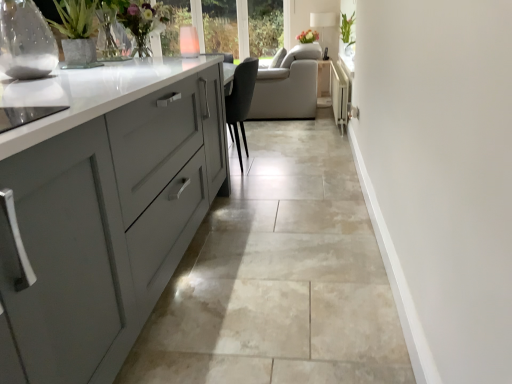
Question: Is green glossy plant at upper right far from clear glass vase at center, the 1th glass vase viewed from the back?

Choices:
 (A) no
 (B) yes

Answer: (A)

Question: Can you confirm if green glossy plant at upper right is wider than clear glass vase at center, which appears as the second glass vase when ordered from the bottom?

Choices:
 (A) yes
 (B) no

Answer: (A)

Question: Is the depth of green glossy plant at upper right less than that of clear glass vase at center, positioned as the second glass vase in left-to-right order?

Choices:
 (A) no
 (B) yes

Answer: (A)

Question: Considering the relative positions of green glossy plant at upper right and clear glass vase at center, the 1th glass vase viewed from the back, in the image provided, is green glossy plant at upper right to the right of clear glass vase at center, the 1th glass vase viewed from the back, from the viewer's perspective?

Choices:
 (A) no
 (B) yes

Answer: (B)

Question: Does green glossy plant at upper right have a greater height compared to clear glass vase at center, the 1th glass vase viewed from the back?

Choices:
 (A) yes
 (B) no

Answer: (A)

Question: Considering the relative positions of clear glass vase at upper left, positioned as the 1th glass vase in left-to-right order, and green glossy plant at upper right in the image provided, is clear glass vase at upper left, positioned as the 1th glass vase in left-to-right order, to the left or to the right of green glossy plant at upper right?

Choices:
 (A) right
 (B) left

Answer: (B)

Question: Considering the positions of clear glass vase at upper left, the 2th glass vase from the back, and green glossy plant at upper right in the image, is clear glass vase at upper left, the 2th glass vase from the back, wider or thinner than green glossy plant at upper right?

Choices:
 (A) wide
 (B) thin

Answer: (A)

Question: Considering their positions, is clear glass vase at upper left, positioned as the 1th glass vase in left-to-right order, located in front of or behind green glossy plant at upper right?

Choices:
 (A) front
 (B) behind

Answer: (A)

Question: In terms of size, does clear glass vase at upper left, the 2th glass vase from the back, appear bigger or smaller than green glossy plant at upper right?

Choices:
 (A) small
 (B) big

Answer: (A)

Question: Is beige tile floor at center wider or thinner than green glossy plant at upper right?

Choices:
 (A) thin
 (B) wide

Answer: (B)

Question: From the image's perspective, is beige tile floor at center located above or below green glossy plant at upper right?

Choices:
 (A) above
 (B) below

Answer: (B)

Question: Is point (331, 246) positioned closer to the camera than point (348, 29)?

Choices:
 (A) farther
 (B) closer

Answer: (B)

Question: Relative to green glossy plant at upper right, is beige tile floor at center in front or behind?

Choices:
 (A) front
 (B) behind

Answer: (A)

Question: From a real-world perspective, is green glossy plant at upper right above or below white fabric lampshade at upper center?

Choices:
 (A) below
 (B) above

Answer: (B)

Question: Is point (343, 16) closer or farther from the camera than point (322, 29)?

Choices:
 (A) farther
 (B) closer

Answer: (B)